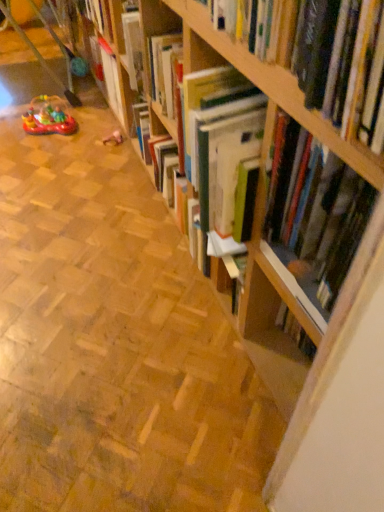
Question: Is wooden bookshelf at center placed right next to hardcover book at upper right?

Choices:
 (A) yes
 (B) no

Answer: (B)

Question: Is wooden bookshelf at center facing away from hardcover book at upper right?

Choices:
 (A) yes
 (B) no

Answer: (B)

Question: Is wooden bookshelf at center facing towards hardcover book at upper right?

Choices:
 (A) no
 (B) yes

Answer: (A)

Question: Would you say hardcover book at upper right is part of wooden bookshelf at center's contents?

Choices:
 (A) yes
 (B) no

Answer: (B)

Question: Considering the relative positions of wooden bookshelf at center and hardcover book at upper right in the image provided, is wooden bookshelf at center behind hardcover book at upper right?

Choices:
 (A) yes
 (B) no

Answer: (A)

Question: From the image's perspective, is wooden bookshelf at center under hardcover book at upper right?

Choices:
 (A) yes
 (B) no

Answer: (B)

Question: Is hardcover book at upper right further to the viewer compared to wooden bookcase at upper right?

Choices:
 (A) yes
 (B) no

Answer: (A)

Question: Considering the relative sizes of hardcover book at upper right and wooden bookcase at upper right in the image provided, is hardcover book at upper right shorter than wooden bookcase at upper right?

Choices:
 (A) no
 (B) yes

Answer: (B)

Question: Is hardcover book at upper right positioned far away from wooden bookcase at upper right?

Choices:
 (A) yes
 (B) no

Answer: (B)

Question: Is hardcover book at upper right not within wooden bookcase at upper right?

Choices:
 (A) yes
 (B) no

Answer: (A)

Question: Considering the relative positions of hardcover book at upper right and wooden bookcase at upper right in the image provided, is hardcover book at upper right in front of wooden bookcase at upper right?

Choices:
 (A) no
 (B) yes

Answer: (A)

Question: Can you confirm if hardcover book at upper right is positioned to the right of wooden bookcase at upper right?

Choices:
 (A) yes
 (B) no

Answer: (A)

Question: Could you tell me if rubber boat at left, acting as the first toy starting from the left, is turned towards hardcover book at upper right?

Choices:
 (A) no
 (B) yes

Answer: (A)